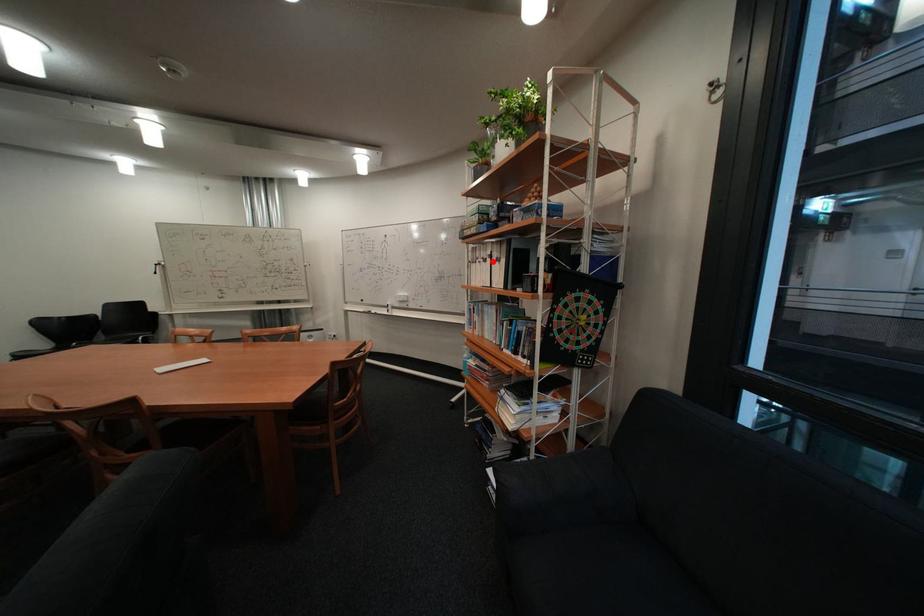
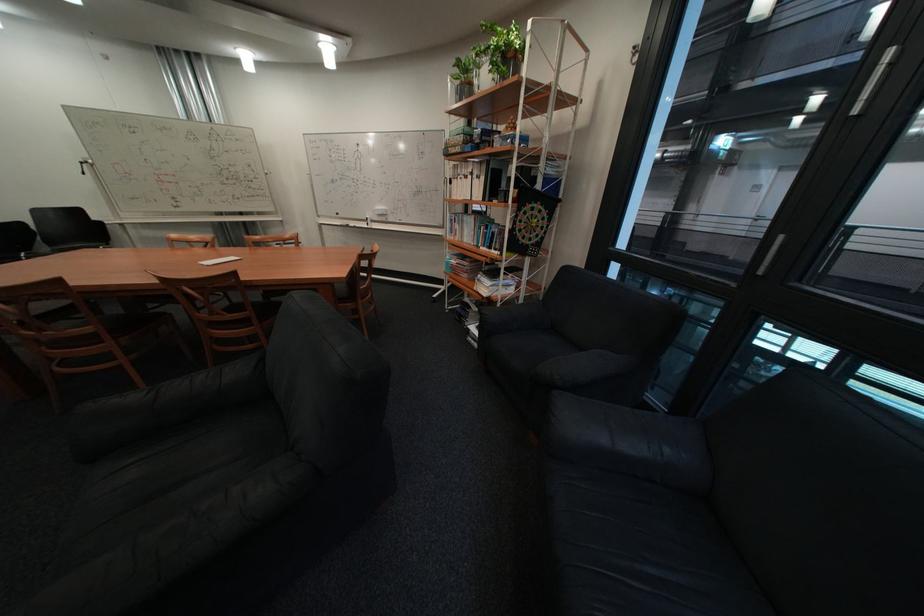
In the second image, find the point that corresponds to the highlighted location in the first image.

(475, 177)